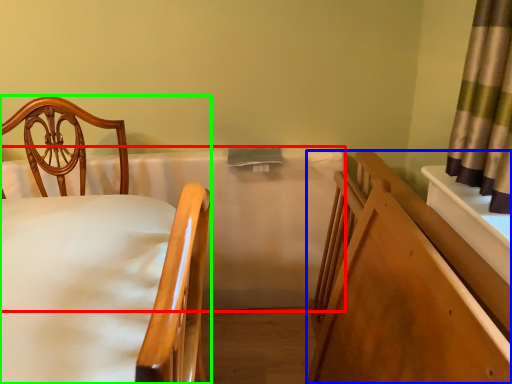
Question: Which is nearer to the mattress (highlighted by a red box)? bed frame (highlighted by a blue box) or chair (highlighted by a green box).

Choices:
 (A) bed frame
 (B) chair

Answer: (B)